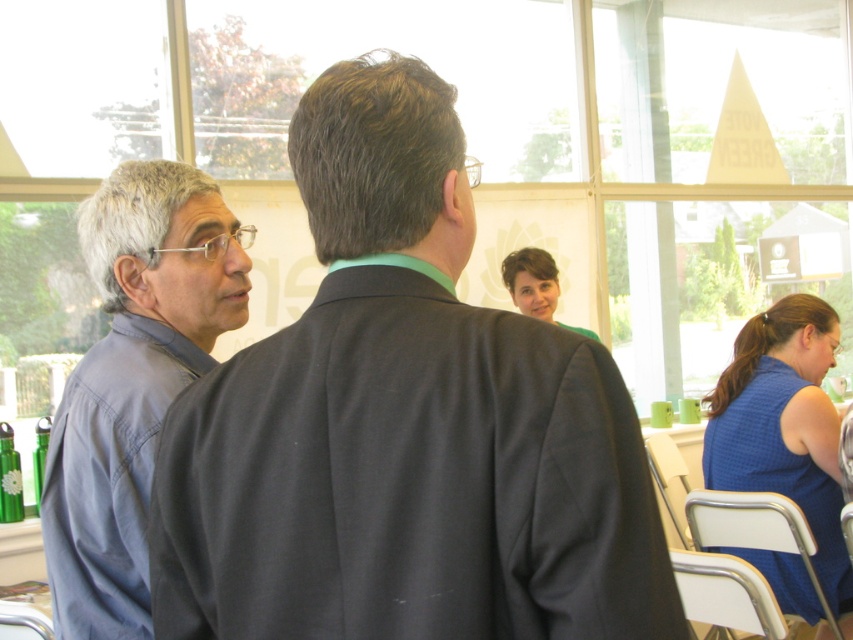
You are standing at the center of the room and want to hand a document to the person wearing the blue cotton shirt at left. Which direction should you move to reach them?

The blue cotton shirt at left is located at point 0.597 on the x axis and 0.157 on the y axis. Since you are at the center, you should move towards the northeast direction to reach them.

You are standing at the point with coordinates point (173, 200) and want to move towards the exit located at point (207, 621). Is the exit directly in front of you?

Yes, the exit at point (207, 621) is directly in front of you since it is in front of point (173, 200) where you are standing.